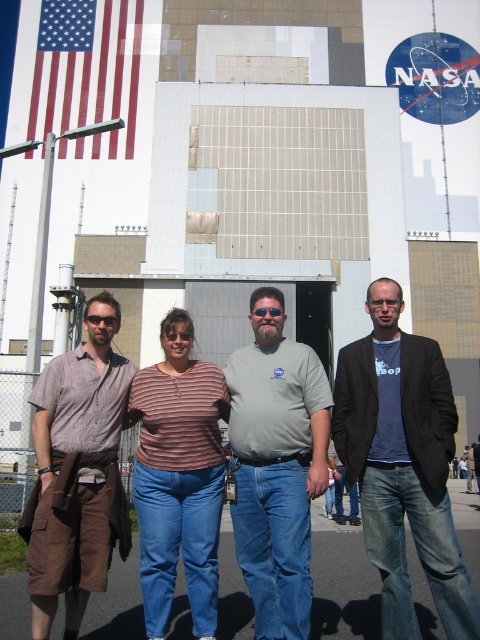
Does dark blue t-shirt at center appear on the right side of red fabric flag at upper left?

Correct, you'll find dark blue t-shirt at center to the right of red fabric flag at upper left.

The image size is (480, 640). Find the location of `dark blue t-shirt at center`. dark blue t-shirt at center is located at coordinates (403, 465).

Identify the location of dark blue t-shirt at center. (403, 465).

Does matte black goggles at center appear under sunglasses at center?

Yes.

The width and height of the screenshot is (480, 640). I want to click on matte black goggles at center, so click(101, 320).

Looking at this image, measure the distance from brown cotton cargo shorts at left to sunglasses at center.

brown cotton cargo shorts at left and sunglasses at center are 6.77 feet apart.

How much distance is there between brown cotton cargo shorts at left and sunglasses at center?

brown cotton cargo shorts at left and sunglasses at center are 6.77 feet apart.

Does point (101, 513) come in front of point (264, 314)?

Yes, it is in front of point (264, 314).

Identify the location of brown cotton cargo shorts at left. (76, 477).